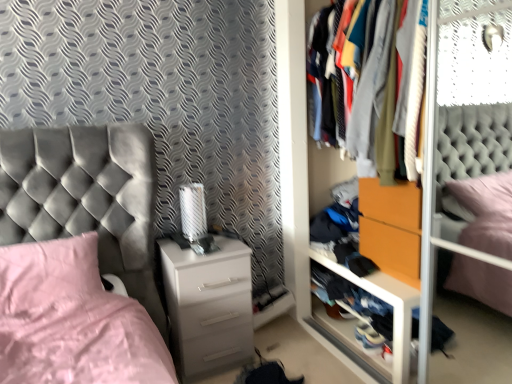
Question: Should I look upward or downward to see pink fabric pillow at lower left?

Choices:
 (A) up
 (B) down

Answer: (B)

Question: Is textured fabric clothes at center shorter than pink fabric pillow at lower left?

Choices:
 (A) no
 (B) yes

Answer: (A)

Question: Is textured fabric clothes at center oriented towards pink fabric pillow at lower left?

Choices:
 (A) no
 (B) yes

Answer: (B)

Question: Is pink fabric pillow at lower left inside textured fabric clothes at center?

Choices:
 (A) yes
 (B) no

Answer: (B)

Question: From the image's perspective, does textured fabric clothes at center appear lower than pink fabric pillow at lower left?

Choices:
 (A) no
 (B) yes

Answer: (A)

Question: Can you confirm if textured fabric clothes at center is bigger than pink fabric pillow at lower left?

Choices:
 (A) yes
 (B) no

Answer: (A)

Question: Can you confirm if textured fabric clothes at center is positioned to the right of pink fabric pillow at lower left?

Choices:
 (A) yes
 (B) no

Answer: (A)

Question: From the image's perspective, is textured fabric clothes at center over orange matte drawer at center?

Choices:
 (A) yes
 (B) no

Answer: (A)

Question: Is textured fabric clothes at center facing towards orange matte drawer at center?

Choices:
 (A) yes
 (B) no

Answer: (B)

Question: Considering the relative sizes of textured fabric clothes at center and orange matte drawer at center in the image provided, is textured fabric clothes at center shorter than orange matte drawer at center?

Choices:
 (A) no
 (B) yes

Answer: (A)

Question: Can you confirm if textured fabric clothes at center is taller than orange matte drawer at center?

Choices:
 (A) yes
 (B) no

Answer: (A)

Question: Considering the relative sizes of textured fabric clothes at center and orange matte drawer at center in the image provided, is textured fabric clothes at center bigger than orange matte drawer at center?

Choices:
 (A) no
 (B) yes

Answer: (B)

Question: From a real-world perspective, is textured fabric clothes at center on top of orange matte drawer at center?

Choices:
 (A) no
 (B) yes

Answer: (B)

Question: Is pink fabric pillow at lower left further to the viewer compared to textured fabric clothes at center?

Choices:
 (A) no
 (B) yes

Answer: (B)